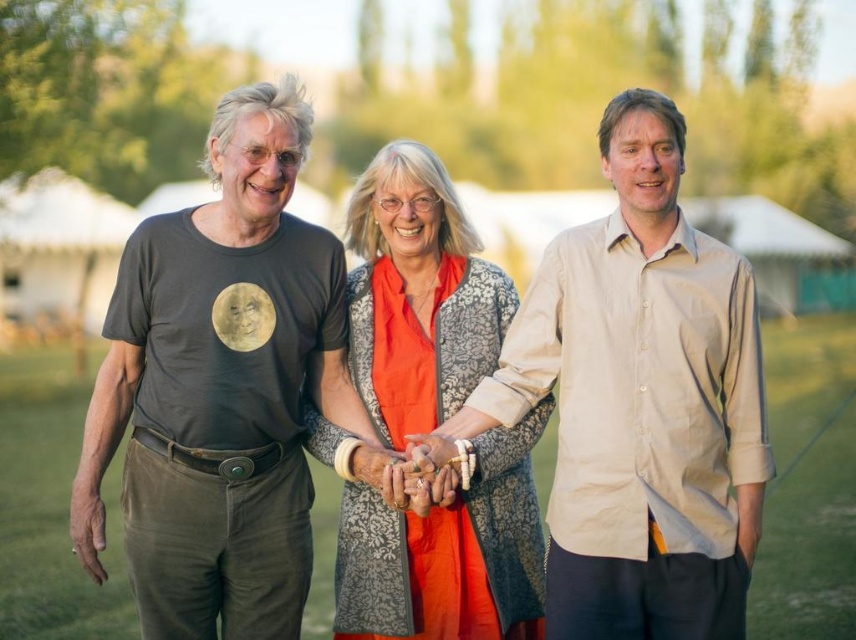
Question: Can you confirm if dark gray t-shirt at center is positioned below beige cotton shirt at center?

Choices:
 (A) no
 (B) yes

Answer: (B)

Question: Is dark gray t-shirt at center below beige cotton shirt at center?

Choices:
 (A) yes
 (B) no

Answer: (A)

Question: Can you confirm if dark gray t-shirt at center is positioned to the right of orange fabric dress at center?

Choices:
 (A) yes
 (B) no

Answer: (B)

Question: Which object is positioned closest to the orange fabric dress at center?

Choices:
 (A) dark gray t-shirt at center
 (B) beige cotton shirt at center

Answer: (A)

Question: Which object is the farthest from the beige cotton shirt at center?

Choices:
 (A) orange fabric dress at center
 (B) dark gray t-shirt at center

Answer: (B)

Question: Which point is farther to the camera?

Choices:
 (A) (657, 602)
 (B) (409, 307)

Answer: (B)